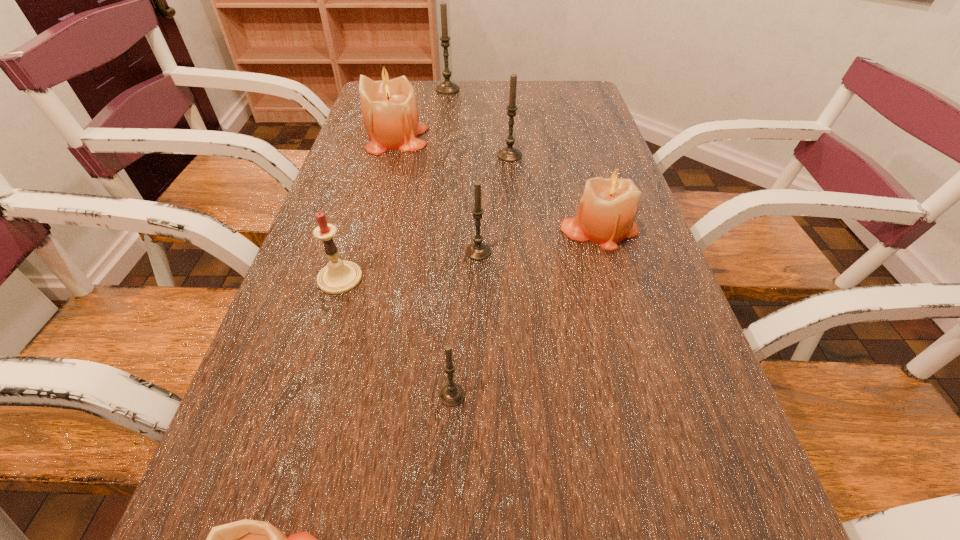
Where is `vacant area between the biggest beige candle and the third farthest gray candle`? Image resolution: width=960 pixels, height=540 pixels. vacant area between the biggest beige candle and the third farthest gray candle is located at coordinates (438, 195).

Locate an element on the screen. The width and height of the screenshot is (960, 540). object that is the seventh closest to the rightmost object is located at coordinates (447, 87).

Identify which object is located as the second nearest to the second nearest beige candle. Please provide its 2D coordinates. Your answer should be formatted as a tuple, i.e. [(x, y)], where the tuple contains the x and y coordinates of a point satisfying the conditions above.

[(509, 154)]

Locate an element on the screen. The width and height of the screenshot is (960, 540). candle that is the fifth closest one to the second candle from right to left is located at coordinates (338, 277).

Identify the location of candle that can be found as the fifth closest to the rightmost beige candle. This screenshot has height=540, width=960. (338, 277).

I want to click on the fourth closest gray candle to the sixth farthest object, so click(x=447, y=87).

Point out which gray candle is positioned as the nearest to the farthest object. Please provide its 2D coordinates. Your answer should be formatted as a tuple, i.e. [(x, y)], where the tuple contains the x and y coordinates of a point satisfying the conditions above.

[(509, 154)]

Find the location of a particular element. The height and width of the screenshot is (540, 960). beige candle that is the third nearest to the second smallest gray candle is located at coordinates (246, 539).

Identify which beige candle is located as the third nearest to the tallest object. Please provide its 2D coordinates. Your answer should be formatted as a tuple, i.e. [(x, y)], where the tuple contains the x and y coordinates of a point satisfying the conditions above.

[(246, 539)]

Find the location of a particular element. The width and height of the screenshot is (960, 540). vacant region that satisfies the following two spatial constraints: 1. on the back side of the sixth farthest candle; 2. on the left side of the biggest beige candle is located at coordinates (383, 138).